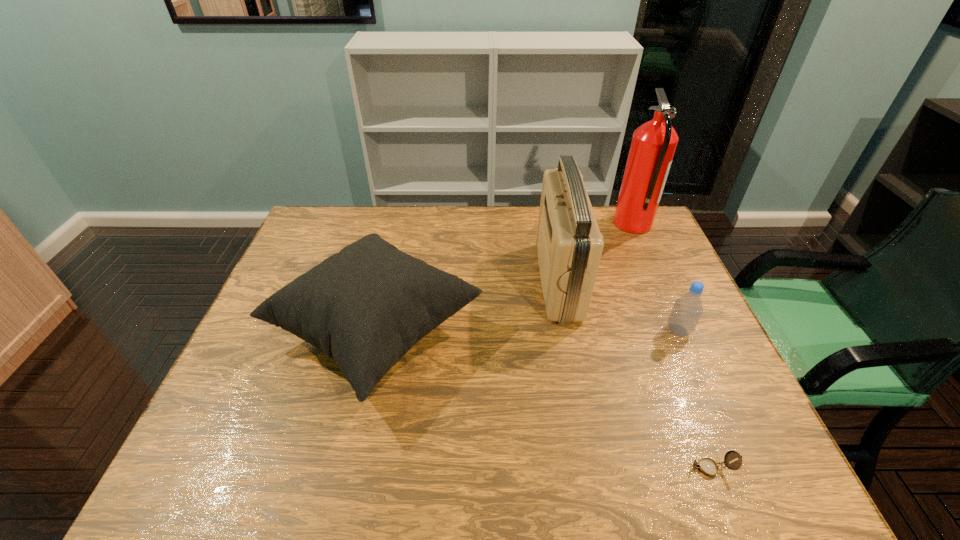
At what (x,y) coordinates should I click in order to perform the action: click on vacant area located at the nozzle of the tallest object. Please return your answer as a coordinate pair (x, y). This screenshot has height=540, width=960. Looking at the image, I should click on (577, 224).

Find the location of `vacant space positioned at the nozzle of the tallest object`. vacant space positioned at the nozzle of the tallest object is located at coordinates (538, 224).

At what (x,y) coordinates should I click in order to perform the action: click on vacant point located 0.080m on the front-facing side of the fourth shortest object. Please return your answer as a coordinate pair (x, y). The height and width of the screenshot is (540, 960). Looking at the image, I should click on pyautogui.click(x=513, y=281).

Locate an element on the screen. This screenshot has width=960, height=540. vacant space located 0.190m on the front-facing side of the fourth shortest object is located at coordinates (476, 281).

This screenshot has height=540, width=960. In order to click on free location located on the front-facing side of the fourth shortest object in this screenshot , I will do `click(483, 281)`.

At what (x,y) coordinates should I click in order to perform the action: click on vacant space situated 0.080m on the front of the cushion. Please return your answer as a coordinate pair (x, y). The image size is (960, 540). Looking at the image, I should click on [346, 467].

At what (x,y) coordinates should I click in order to perform the action: click on free space located 0.110m on the front of the bottle. Please return your answer as a coordinate pair (x, y). Image resolution: width=960 pixels, height=540 pixels. Looking at the image, I should click on (698, 375).

Where is `vacant area situated 0.100m on the face of the nearest object`? vacant area situated 0.100m on the face of the nearest object is located at coordinates (640, 468).

This screenshot has height=540, width=960. I want to click on vacant area situated 0.300m on the face of the nearest object, so click(544, 468).

Locate an element on the screen. vacant space located 0.080m on the face of the nearest object is located at coordinates (650, 468).